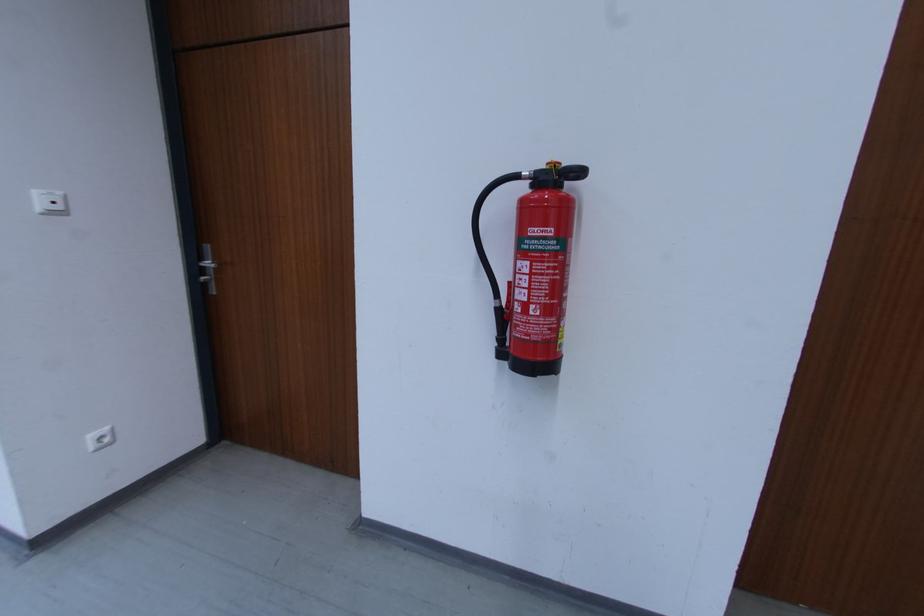
The width and height of the screenshot is (924, 616). I want to click on extinguisher handle, so click(x=473, y=215).